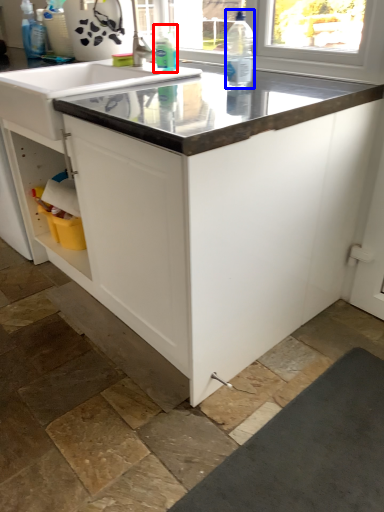
Question: Which object is further to the camera taking this photo, cleaning product (highlighted by a red box) or bottle (highlighted by a blue box)?

Choices:
 (A) cleaning product
 (B) bottle

Answer: (A)